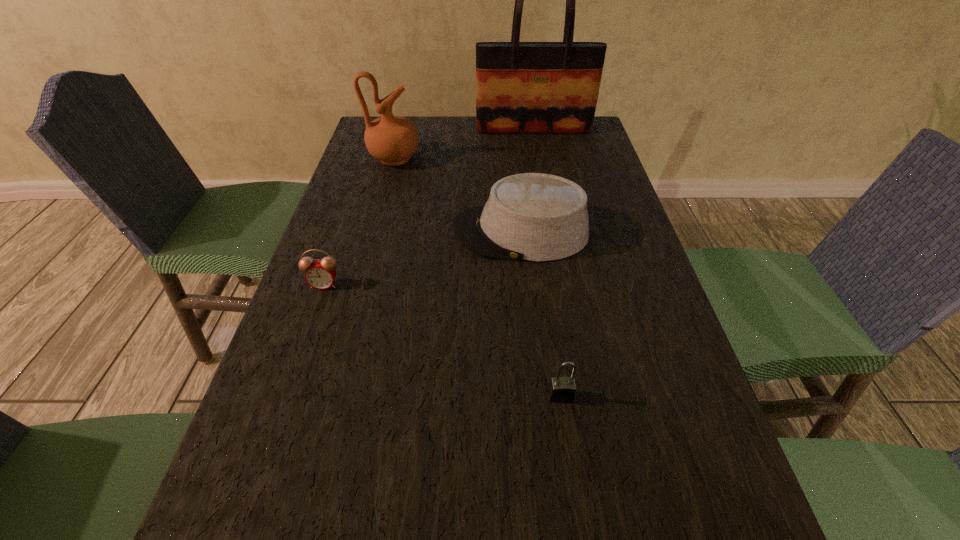
You are a GUI agent. You are given a task and a screenshot of the screen. Output one action in this format:
    pyautogui.click(x=<x>, y=<y>)
    Task: Click on the unoccupied area between the shopping bag and the fourth nearest object
    
    Given the screenshot: What is the action you would take?
    pyautogui.click(x=464, y=145)

Locate an element on the screen. The image size is (960, 540). vacant area between the nearest object and the alarm clock is located at coordinates (443, 340).

Where is `free point between the fourth farthest object and the third farthest object`? The width and height of the screenshot is (960, 540). free point between the fourth farthest object and the third farthest object is located at coordinates click(422, 258).

Point out which object is positioned as the second nearest to the third nearest object. Please provide its 2D coordinates. Your answer should be formatted as a tuple, i.e. [(x, y)], where the tuple contains the x and y coordinates of a point satisfying the conditions above.

[(320, 274)]

The width and height of the screenshot is (960, 540). I want to click on object that is the third nearest to the nearest object, so click(x=391, y=139).

The height and width of the screenshot is (540, 960). I want to click on free point that satisfies the following two spatial constraints: 1. on the front-facing side of the shopping bag; 2. on the front-facing side of the third farthest object, so click(552, 232).

Locate an element on the screen. Image resolution: width=960 pixels, height=540 pixels. free space that satisfies the following two spatial constraints: 1. on the spout of the second farthest object; 2. on the clock face of the fourth farthest object is located at coordinates (361, 285).